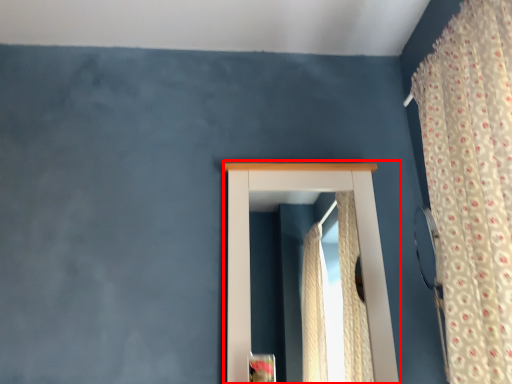
Question: From the image's perspective, considering the relative positions of window (annotated by the red box) and curtain in the image provided, where is window (annotated by the red box) located with respect to the staircase?

Choices:
 (A) below
 (B) above

Answer: (A)